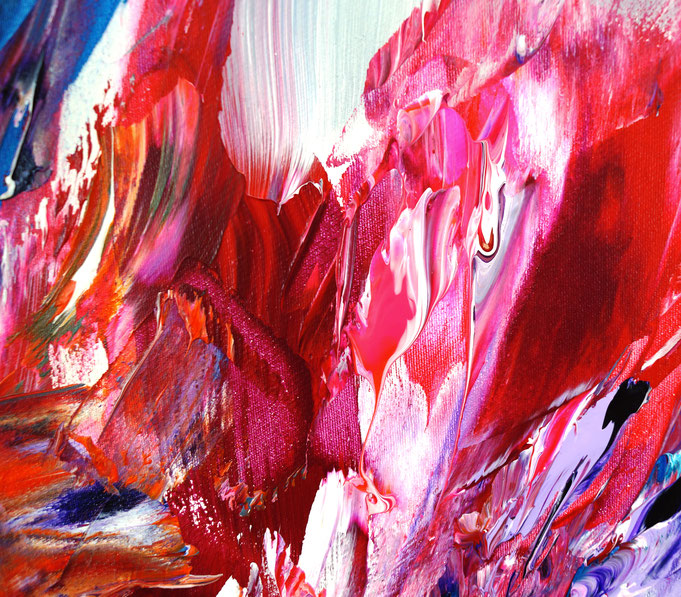
You are a GUI agent. You are given a task and a screenshot of the screen. Output one action in this format:
    pyautogui.click(x=<x>, y=<y>)
    Task: Click on the blue paint
    Image resolution: width=681 pixels, height=597 pixels.
    Given the screenshot: What is the action you would take?
    pyautogui.click(x=103, y=17)